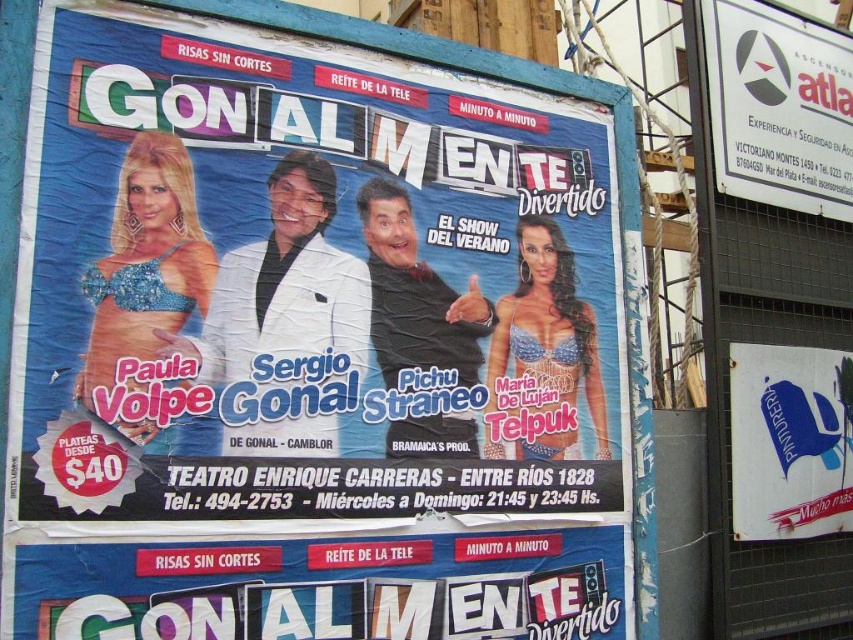
Is point (456, 468) behind point (364, 627)?

Yes, it is.

Who is more distant from viewer, (112, 284) or (584, 618)?

Positioned behind is point (584, 618).

The height and width of the screenshot is (640, 853). What are the coordinates of `blue paper poster at upper left` in the screenshot? It's located at (305, 284).

Is point (331, 544) behind point (759, 28)?

No.

Is the position of blue cardboard sign at center more distant than that of white plastic sign at upper right?

No, it is in front of white plastic sign at upper right.

Who is more forward, (25,632) or (782,93)?

Point (25,632) is in front.

I want to click on blue cardboard sign at center, so click(x=322, y=586).

Does blue paper poster at upper left have a greater height compared to white plastic sign at upper right?

Yes.

Can you confirm if blue paper poster at upper left is positioned below white plastic sign at upper right?

Indeed, blue paper poster at upper left is positioned under white plastic sign at upper right.

The width and height of the screenshot is (853, 640). Describe the element at coordinates (305, 284) in the screenshot. I see `blue paper poster at upper left` at that location.

Locate an element on the screen. The height and width of the screenshot is (640, 853). blue paper poster at upper left is located at coordinates (305, 284).